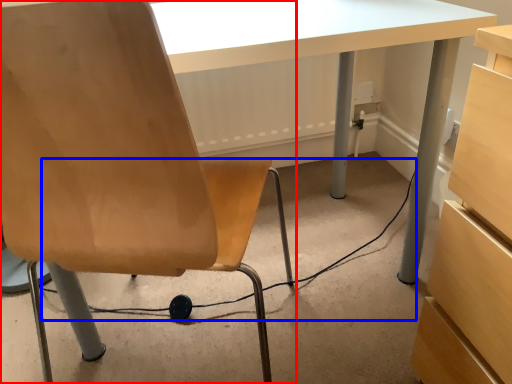
Question: Which of the following is the closest to the observer, chair (highlighted by a red box) or cable (highlighted by a blue box)?

Choices:
 (A) chair
 (B) cable

Answer: (A)